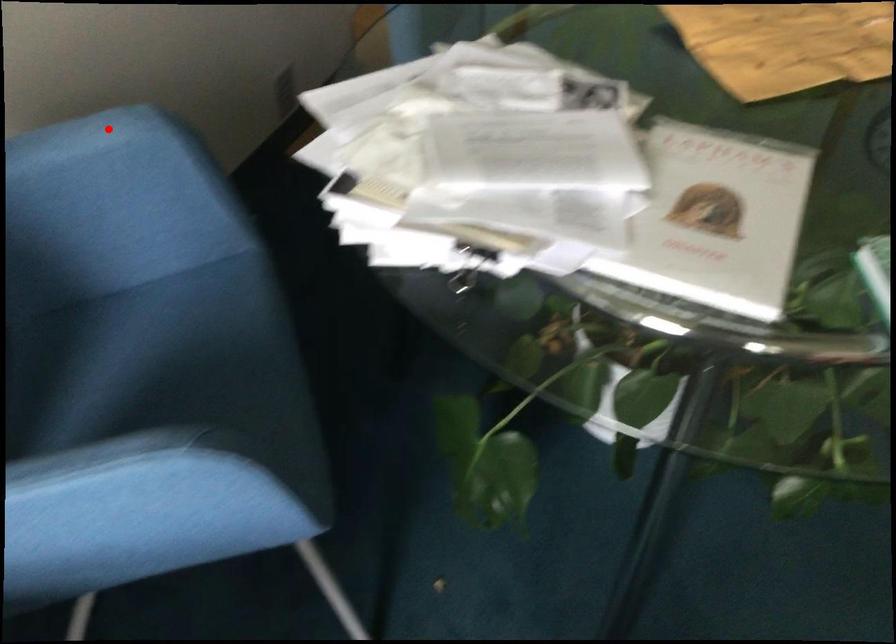
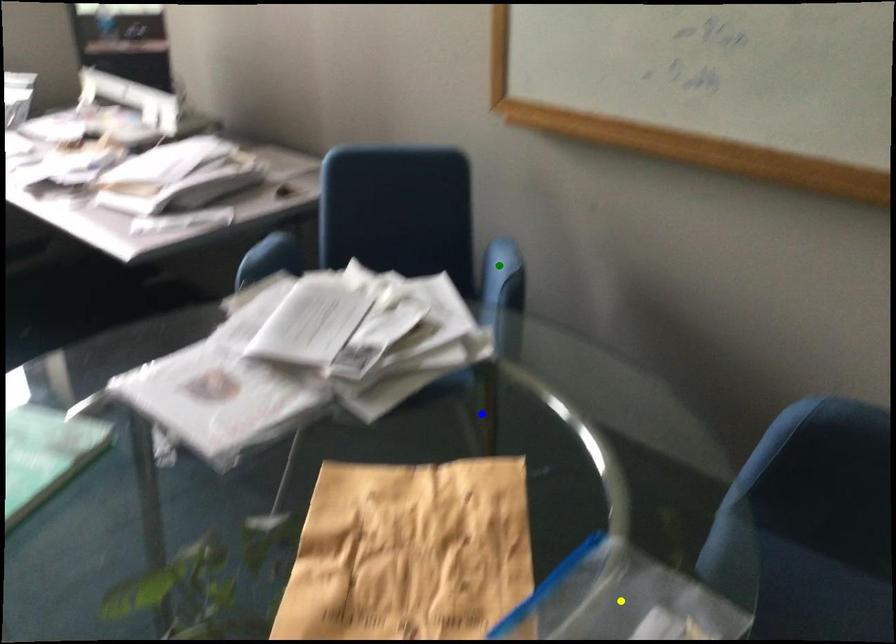
Question: I am providing you with two images of the same scene from different viewpoints. A red point is marked on the first image. You are given multiple points on the second image. Which point in image 2 is actually the same real-world point as the red point in image 1?

Choices:
 (A) yellow point
 (B) blue point
 (C) green point

Answer: (C)